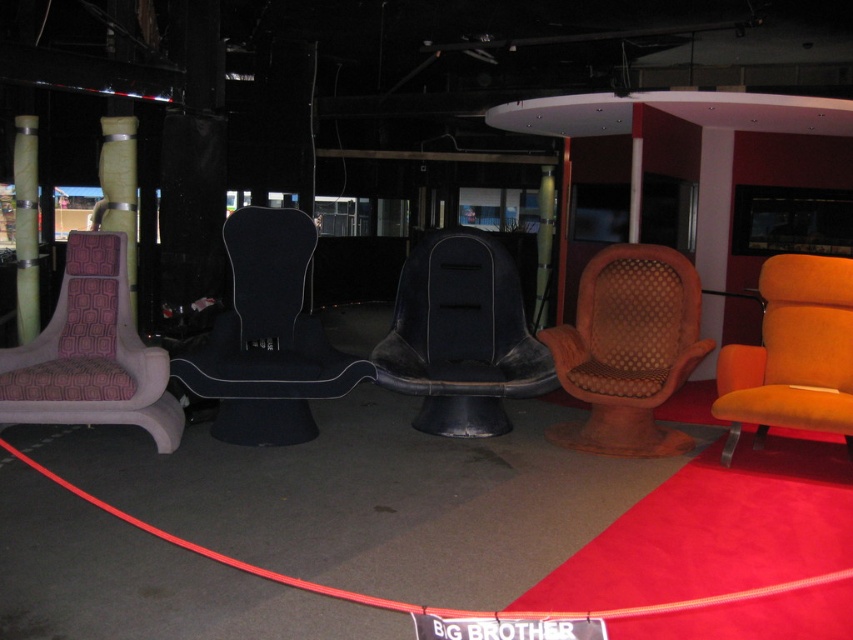
In the room with the Big Brother sign, there are five unique chairs arranged in a semi circle. You are standing at the center of the room and want to move towards the black fabric chair at center. Which direction should you move? The chairs include a light beige frame with patterned pink cushion on the far left, a sleek black chair with curved backrest and a. (265, 337) marks black fabric chair at center. The other chairs are arranged around it in a semi circle. The point is at the center of the room. So

You should move towards the center of the room, where the black fabric chair at center is located, as the point (265, 337) marks its position at the center. Since you are already at the center, you don t need to move further. However, if the chairs are arranged in a semi circle around it, you might be standing near the black fabric chair already. Wait, the description says you are standing at the center, so the black fabric chair is right where you are. Therefore, you don t need to move any direction. But

You are standing in the center of the room and want to move towards the black leather chair at center. Which direction should you move to reach it?

The black leather chair at center is located at point (461, 337), so you should move towards the center of the room to reach it.